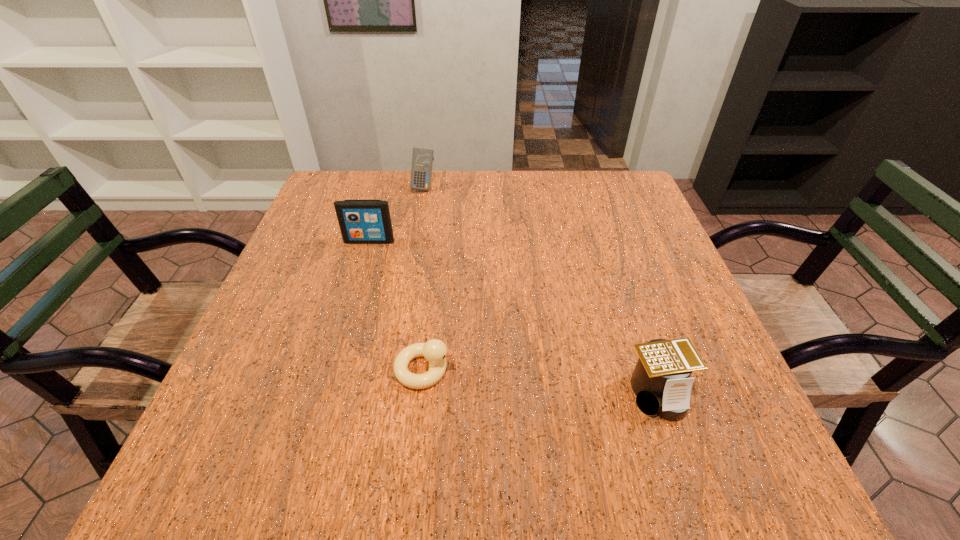
Locate an element on the screen. The image size is (960, 540). free point between the right calculator and the leftmost object is located at coordinates (514, 317).

Choose which object is the nearest neighbor to the rightmost object. Please provide its 2D coordinates. Your answer should be formatted as a tuple, i.e. [(x, y)], where the tuple contains the x and y coordinates of a point satisfying the conditions above.

[(435, 351)]

Identify which object is the second nearest to the shortest object. Please provide its 2D coordinates. Your answer should be formatted as a tuple, i.e. [(x, y)], where the tuple contains the x and y coordinates of a point satisfying the conditions above.

[(361, 221)]

The width and height of the screenshot is (960, 540). What are the coordinates of `vacant space that satisfies the following two spatial constraints: 1. on the back side of the rightmost object; 2. at the beak of the duckling` in the screenshot? It's located at (650, 369).

The image size is (960, 540). What are the coordinates of `free space that satisfies the following two spatial constraints: 1. at the beak of the duckling; 2. on the back side of the second shortest object` in the screenshot? It's located at (421, 393).

Locate an element on the screen. Image resolution: width=960 pixels, height=540 pixels. free region that satisfies the following two spatial constraints: 1. on the back side of the shorter calculator; 2. at the beak of the duckling is located at coordinates (650, 369).

The width and height of the screenshot is (960, 540). I want to click on vacant space that satisfies the following two spatial constraints: 1. on the back side of the second shortest object; 2. at the beak of the shortest object, so click(x=650, y=369).

The height and width of the screenshot is (540, 960). Find the location of `vacant region that satisfies the following two spatial constraints: 1. at the beak of the shortest object; 2. on the right side of the nearer calculator`. vacant region that satisfies the following two spatial constraints: 1. at the beak of the shortest object; 2. on the right side of the nearer calculator is located at coordinates (421, 393).

Identify the location of free space that satisfies the following two spatial constraints: 1. at the beak of the shorter calculator; 2. on the right side of the duckling. (421, 393).